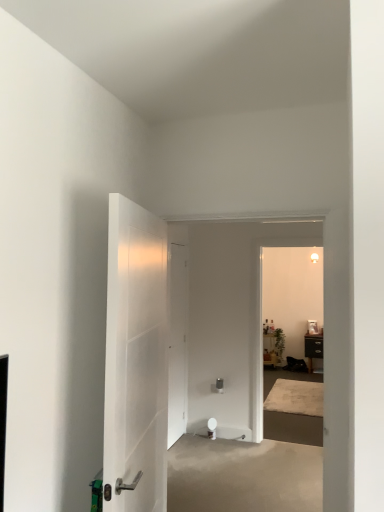
I want to click on vacant area that is situated to the right of white matte door at center, placed as the 1th door when sorted from back to front, so click(212, 441).